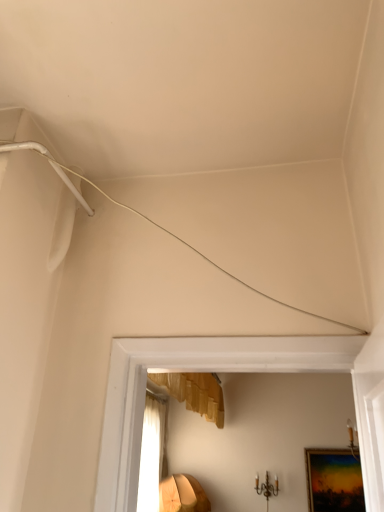
The image size is (384, 512). I want to click on matte wooden picture frame at lower right, so click(334, 480).

What do you see at coordinates (334, 480) in the screenshot?
I see `matte wooden picture frame at lower right` at bounding box center [334, 480].

At what (x,y) coordinates should I click in order to perform the action: click on matte wooden picture frame at lower right. Please return your answer as a coordinate pair (x, y). The height and width of the screenshot is (512, 384). Looking at the image, I should click on (334, 480).